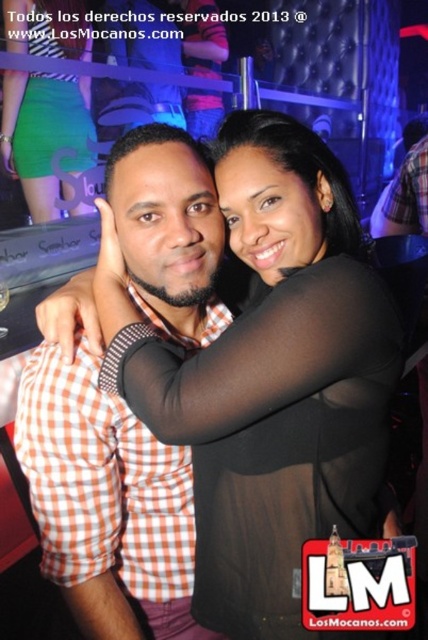
Question: Is the position of orange checkered shirt at center less distant than that of green matte skirt at lower left?

Choices:
 (A) yes
 (B) no

Answer: (A)

Question: Which of these objects is positioned closest to the green matte skirt at lower left?

Choices:
 (A) black sheer top at center
 (B) orange checkered shirt at center

Answer: (B)

Question: Which object is the farthest from the orange checkered shirt at center?

Choices:
 (A) green matte skirt at lower left
 (B) black sheer top at center

Answer: (A)

Question: Among these points, which one is nearest to the camera?

Choices:
 (A) (299, 470)
 (B) (86, 499)
 (C) (20, 124)

Answer: (A)

Question: Can you confirm if black sheer top at center is positioned to the left of green matte skirt at lower left?

Choices:
 (A) no
 (B) yes

Answer: (A)

Question: Is black sheer top at center smaller than green matte skirt at lower left?

Choices:
 (A) yes
 (B) no

Answer: (A)